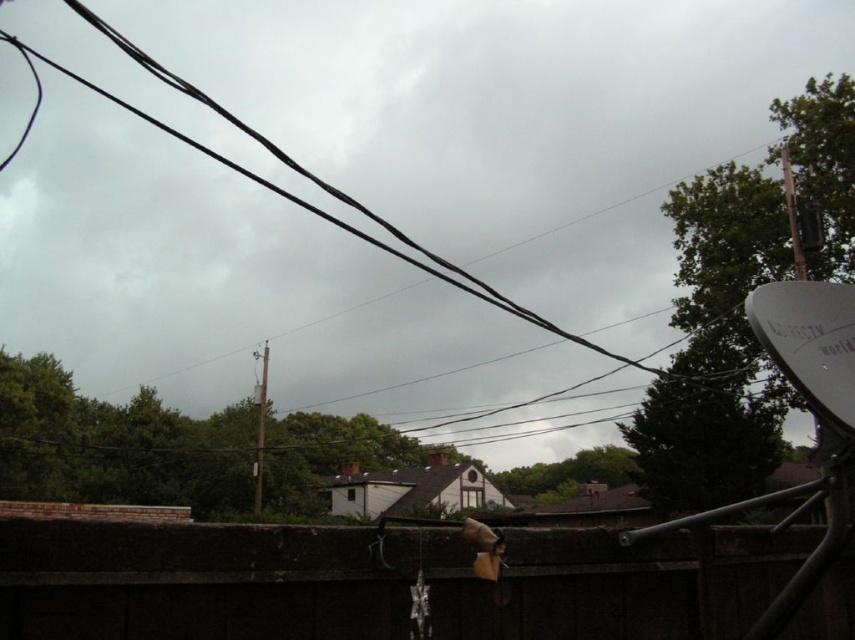
What is located at the point with coordinates (x=500, y=122)?

A black wire at upper center is located at the point with coordinates (x=500, y=122).

You are a maintenance worker inspecting utility wires. You notice the black wire at upper center and the smooth gray pole at center. Which object is positioned to the left of the other?

The black wire at upper center is to the left of smooth gray pole at center.

You are a bird perched on a branch and want to land on the black wire at upper center. What coordinates should you aim for?

The black wire at upper center is located at coordinates point (500, 122).